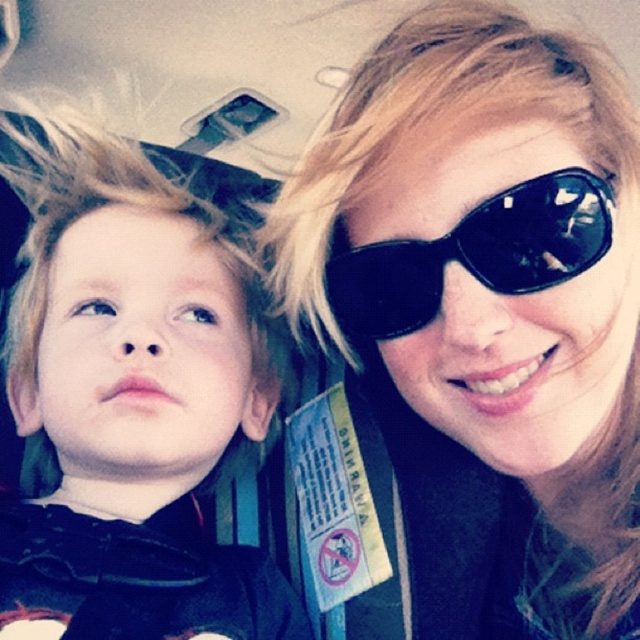
Consider the image. Can you confirm if black matte sunglasses at upper right is taller than black reflective sunglasses at upper right?

Yes, black matte sunglasses at upper right is taller than black reflective sunglasses at upper right.

The width and height of the screenshot is (640, 640). What do you see at coordinates (486, 312) in the screenshot?
I see `black matte sunglasses at upper right` at bounding box center [486, 312].

Is point (474, 42) more distant than point (364, 316)?

No, it is in front of (364, 316).

What are the coordinates of `black matte sunglasses at upper right` in the screenshot? It's located at (486, 312).

Which is more to the right, black matte sunglasses at upper right or blonde hair at left?

From the viewer's perspective, black matte sunglasses at upper right appears more on the right side.

Is black matte sunglasses at upper right behind blonde hair at left?

No.

Where is `black matte sunglasses at upper right`? black matte sunglasses at upper right is located at coordinates (486, 312).

Does blonde hair at left have a larger size compared to black reflective sunglasses at upper right?

Correct, blonde hair at left is larger in size than black reflective sunglasses at upper right.

Who is shorter, blonde hair at left or black reflective sunglasses at upper right?

black reflective sunglasses at upper right is shorter.

Locate an element on the screen. The width and height of the screenshot is (640, 640). blonde hair at left is located at coordinates (131, 403).